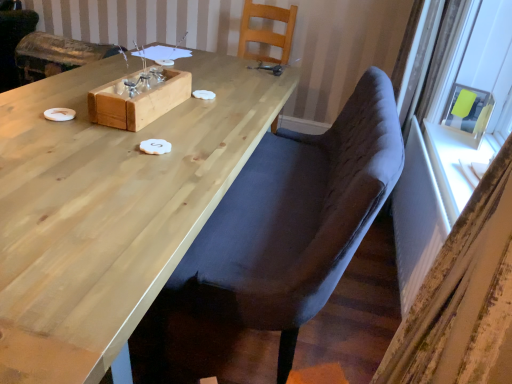
Identify the location of vacant region to the left of yellow paper at upper right. Image resolution: width=512 pixels, height=384 pixels. (436, 131).